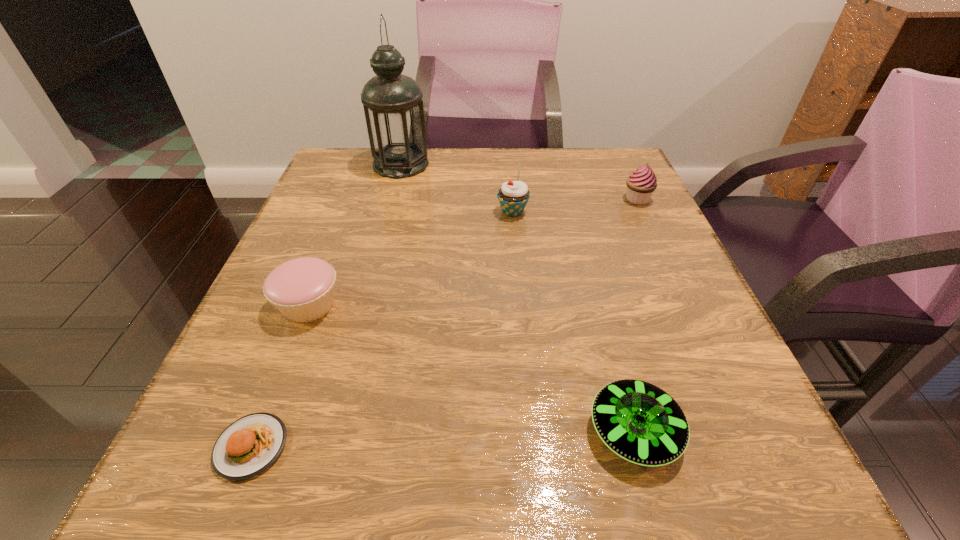
I want to click on cupcake positioned at the left edge, so click(x=302, y=289).

This screenshot has height=540, width=960. I want to click on food located in the left edge section of the desktop, so click(x=248, y=446).

Find the location of `cupcake at the right edge`. cupcake at the right edge is located at coordinates (642, 183).

Locate an element on the screen. The image size is (960, 540). saucer that is at the right edge is located at coordinates (640, 422).

Identify the location of object present at the far left corner. The height and width of the screenshot is (540, 960). (393, 106).

Locate an element on the screen. The height and width of the screenshot is (540, 960). object that is at the near left corner is located at coordinates (248, 446).

Find the location of a particular element. This screenshot has height=540, width=960. object positioned at the far right corner is located at coordinates (642, 183).

Locate an element on the screen. This screenshot has height=540, width=960. object situated at the near right corner is located at coordinates (640, 422).

I want to click on blank space at the far edge of the desktop, so click(506, 152).

The width and height of the screenshot is (960, 540). In order to click on free space at the near edge of the desktop in this screenshot , I will do `click(640, 505)`.